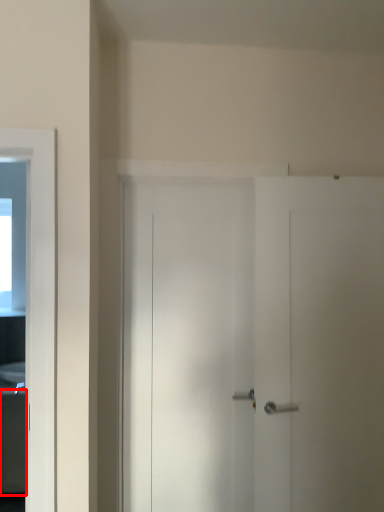
Question: From the image, what is the correct spatial relationship of cabinetry (annotated by the red box) in relation to sink?

Choices:
 (A) left
 (B) right

Answer: (A)